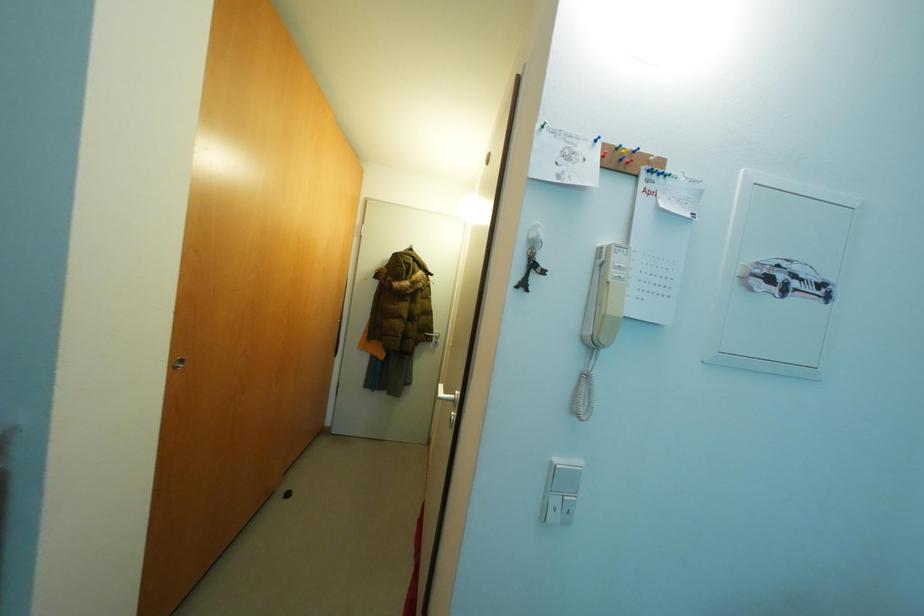
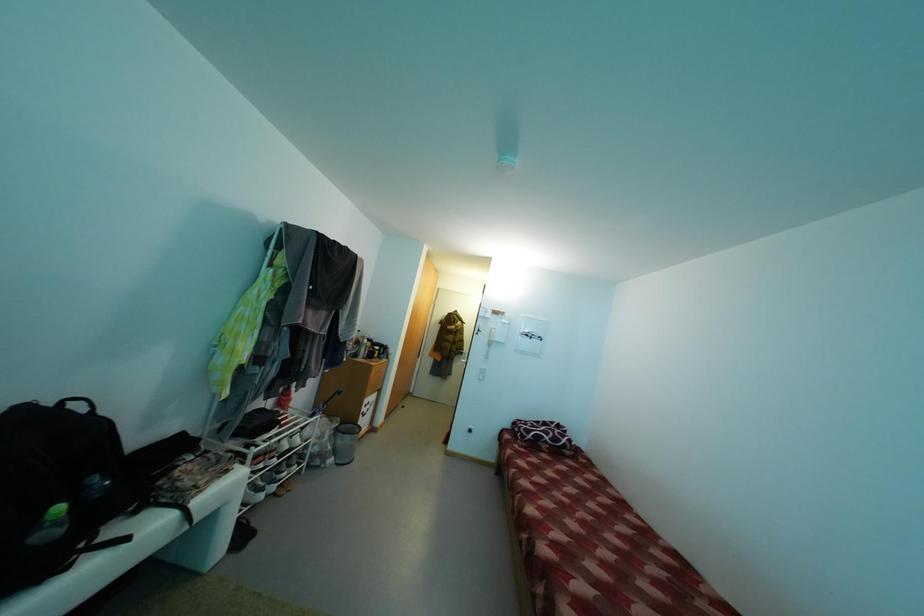
Question: Which direction would the cameraman need to move to produce the second image? Reply with the corresponding letter.

Choices:
 (A) Left
 (B) Right
 (C) Forward
 (D) Backward

Answer: (D)